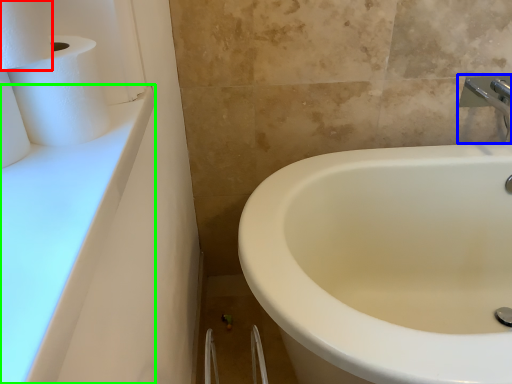
Question: Which object is the farthest from toilet paper (highlighted by a red box)? Choose among these: tap (highlighted by a blue box) or counter top (highlighted by a green box).

Choices:
 (A) tap
 (B) counter top

Answer: (A)